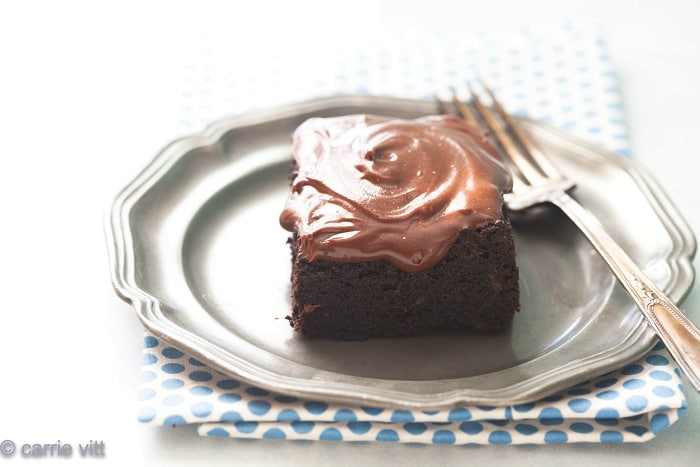
You are a GUI agent. You are given a task and a screenshot of the screen. Output one action in this format:
    pyautogui.click(x=<x>, y=<y>)
    Task: Click on the napkin with blue polka dots
    Image resolution: width=700 pixels, height=467 pixels.
    Given the screenshot: What is the action you would take?
    pyautogui.click(x=572, y=413)